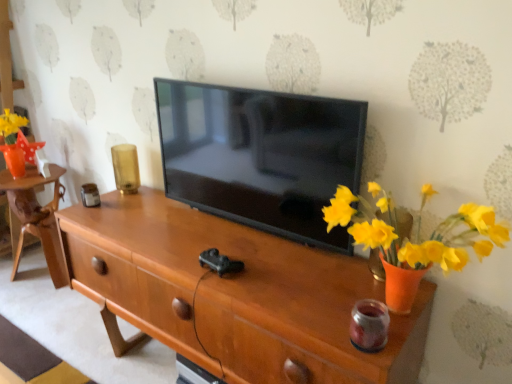
Question: From a real-world perspective, is wooden tv stand at center located higher than black glossy tv at center?

Choices:
 (A) yes
 (B) no

Answer: (B)

Question: Is black glossy tv at center at the back of wooden tv stand at center?

Choices:
 (A) no
 (B) yes

Answer: (A)

Question: From the image's perspective, would you say wooden tv stand at center is shown under black glossy tv at center?

Choices:
 (A) yes
 (B) no

Answer: (A)

Question: From a real-world perspective, is wooden tv stand at center positioned under black glossy tv at center based on gravity?

Choices:
 (A) yes
 (B) no

Answer: (A)

Question: Is wooden tv stand at center positioned in front of black glossy tv at center?

Choices:
 (A) no
 (B) yes

Answer: (B)

Question: Can you confirm if wooden tv stand at center is taller than black glossy tv at center?

Choices:
 (A) no
 (B) yes

Answer: (B)

Question: Considering the relative positions of wooden cabinet at left and wooden tv stand at center in the image provided, is wooden cabinet at left behind wooden tv stand at center?

Choices:
 (A) no
 (B) yes

Answer: (B)

Question: Is wooden cabinet at left bigger than wooden tv stand at center?

Choices:
 (A) yes
 (B) no

Answer: (B)

Question: Can you confirm if wooden cabinet at left is smaller than wooden tv stand at center?

Choices:
 (A) yes
 (B) no

Answer: (A)

Question: From a real-world perspective, does wooden cabinet at left sit lower than wooden tv stand at center?

Choices:
 (A) no
 (B) yes

Answer: (A)

Question: From the image's perspective, is wooden cabinet at left located beneath wooden tv stand at center?

Choices:
 (A) no
 (B) yes

Answer: (A)

Question: Are wooden cabinet at left and wooden tv stand at center making contact?

Choices:
 (A) yes
 (B) no

Answer: (B)

Question: From the image's perspective, is wooden table at left below wooden tv stand at center?

Choices:
 (A) yes
 (B) no

Answer: (B)